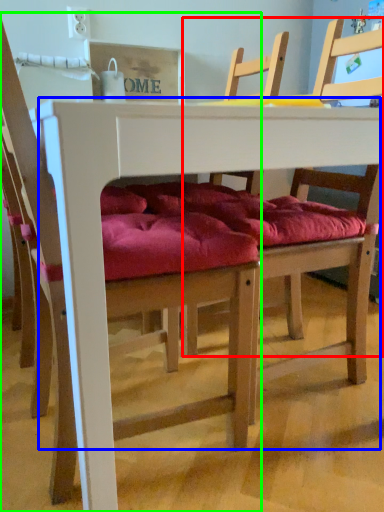
Question: Estimate the real-world distances between objects in this image. Which object is farther from chair (highlighted by a red box), table (highlighted by a blue box) or chair (highlighted by a green box)?

Choices:
 (A) table
 (B) chair

Answer: (A)